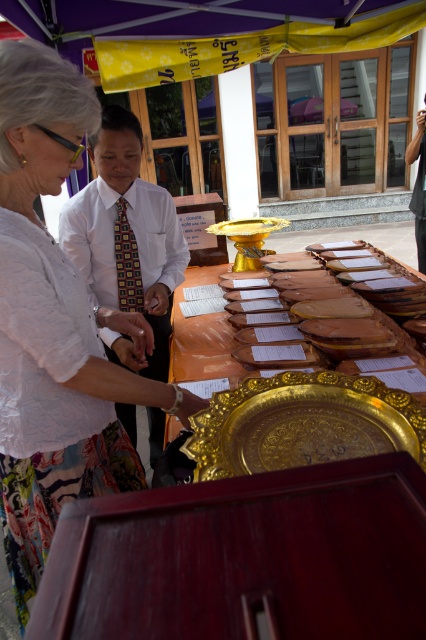
Is white lace blouse at upper left bigger than white shirt with tie at center?

Incorrect, white lace blouse at upper left is not larger than white shirt with tie at center.

What do you see at coordinates (54, 326) in the screenshot? I see `white lace blouse at upper left` at bounding box center [54, 326].

Between point (26, 372) and point (123, 416), which one is positioned in front?

Point (26, 372)

Find the location of `white lace blouse at upper left`. white lace blouse at upper left is located at coordinates (54, 326).

Can you confirm if white shirt with tie at center is taller than light brown suit at center?

No, white shirt with tie at center is not taller than light brown suit at center.

Does point (172, 252) come behind point (420, 166)?

No, it is not.

Image resolution: width=426 pixels, height=640 pixels. What do you see at coordinates (126, 241) in the screenshot? I see `white shirt with tie at center` at bounding box center [126, 241].

I want to click on white shirt with tie at center, so click(126, 241).

Does white shirt with tie at center have a larger size compared to multicolored woven tie at center?

Yes, white shirt with tie at center is bigger than multicolored woven tie at center.

Does point (140, 211) lie behind point (121, 276)?

Yes, point (140, 211) is farther from viewer.

Who is more distant from viewer, (126, 145) or (137, 300)?

The point (137, 300) is behind.

I want to click on white shirt with tie at center, so 126,241.